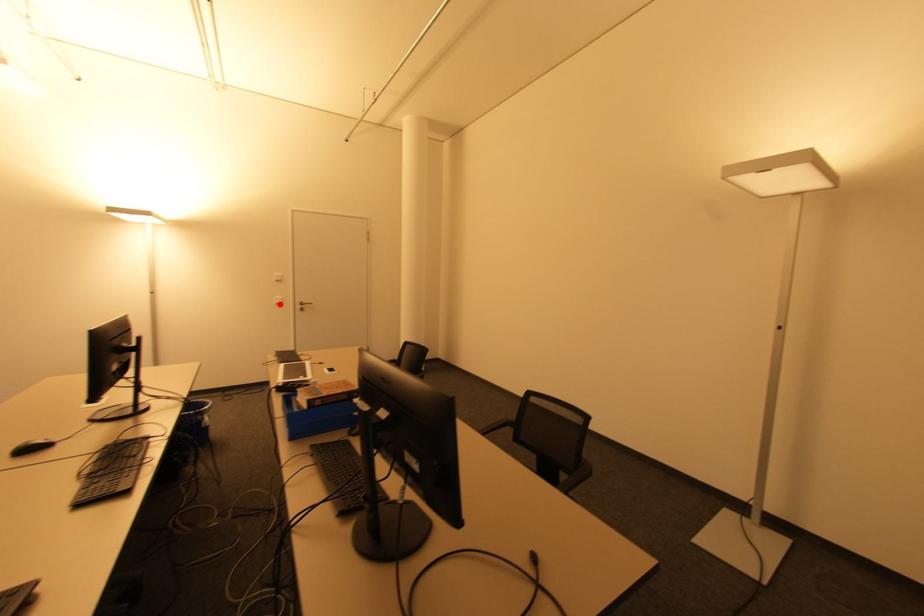
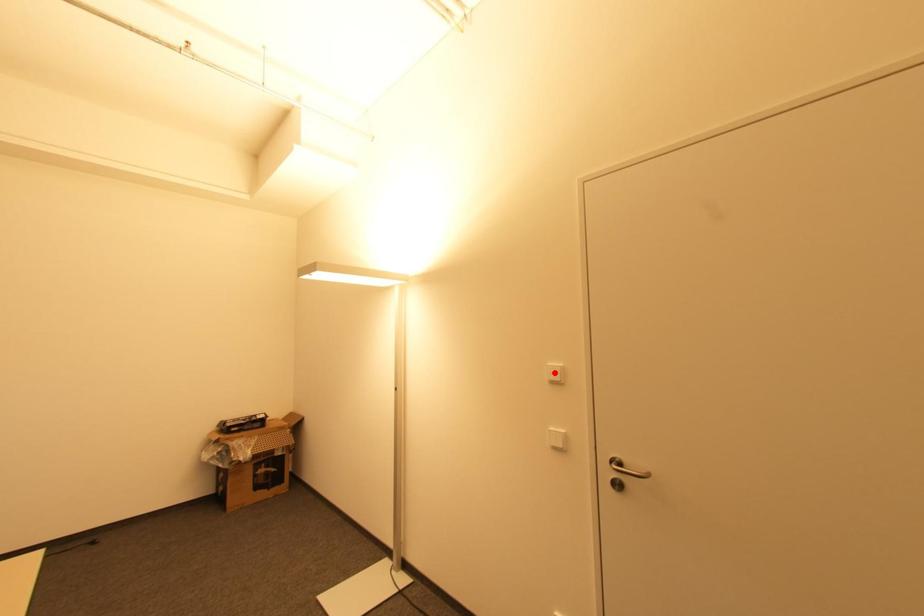
I am providing you with two images of the same scene from different viewpoints. A red point is marked on the first image and another point is marked on the second image. Does the point marked in image1 correspond to the same location as the one in image2?

No